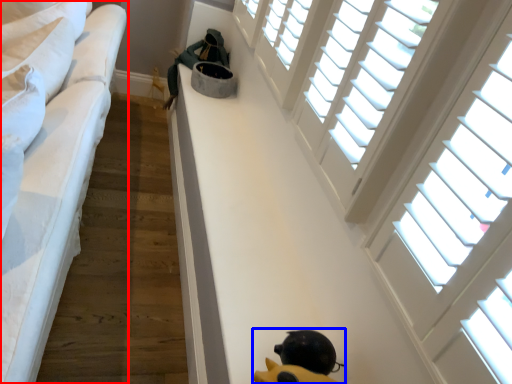
Question: Which object appears closest to the camera in this image, furniture (highlighted by a red box) or toy (highlighted by a blue box)?

Choices:
 (A) furniture
 (B) toy

Answer: (A)